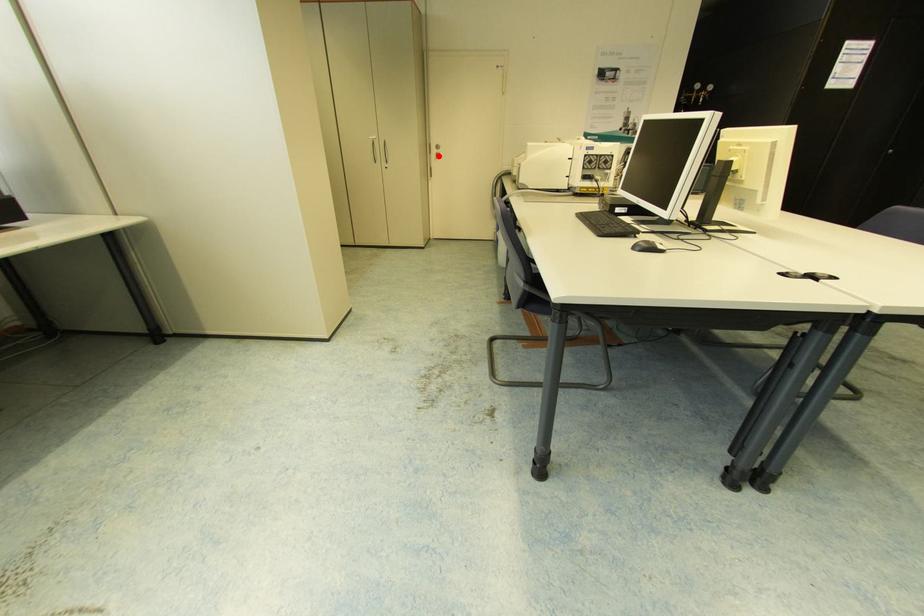
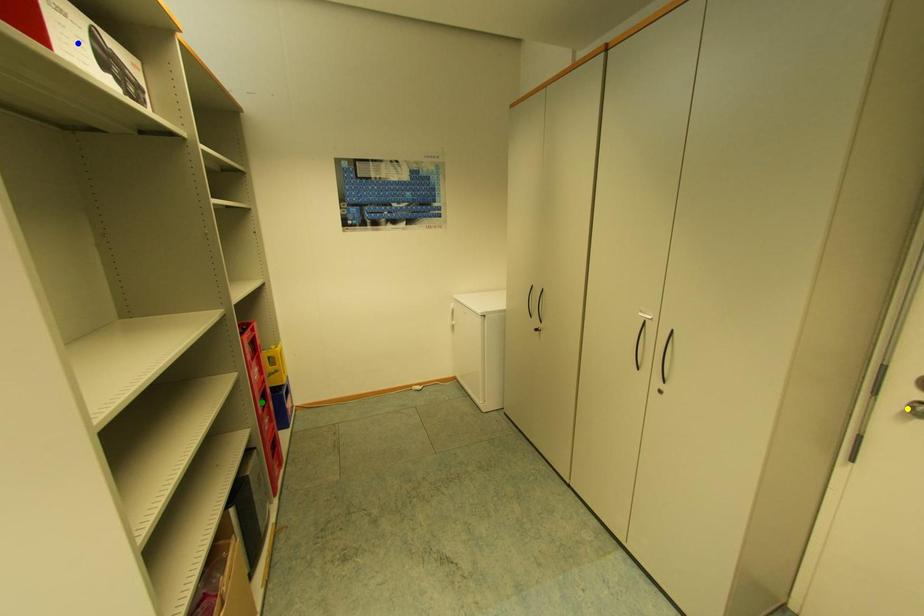
Question: I am providing you with two images of the same scene from different viewpoints. A red point is marked on the first image. You are given multiple points on the second image. Which mark in image 2 goes with the point in image 1?

Choices:
 (A) green point
 (B) blue point
 (C) yellow point

Answer: (C)